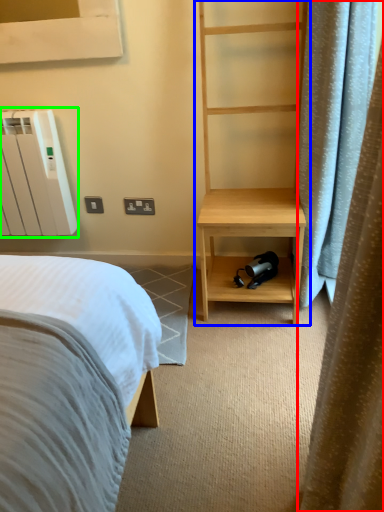
Question: Estimate the real-world distances between objects in this image. Which object is farther from curtain (highlighted by a red box), bookshelf (highlighted by a blue box) or radiator (highlighted by a green box)?

Choices:
 (A) bookshelf
 (B) radiator

Answer: (B)